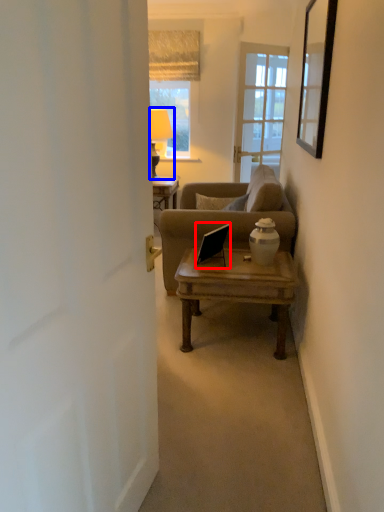
Question: Which of the following is the farthest to the observer, laptop (highlighted by a red box) or lamp (highlighted by a blue box)?

Choices:
 (A) laptop
 (B) lamp

Answer: (B)